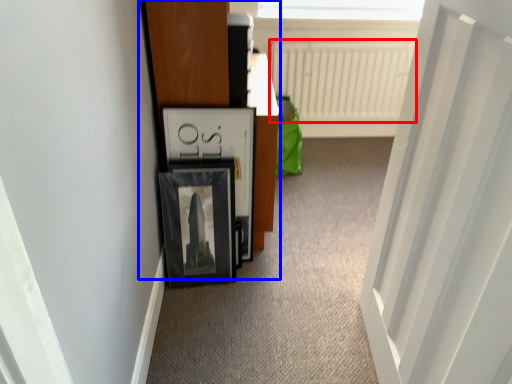
Question: Which of the following is the farthest to the observer, radiator (highlighted by a red box) or dresser (highlighted by a blue box)?

Choices:
 (A) radiator
 (B) dresser

Answer: (A)